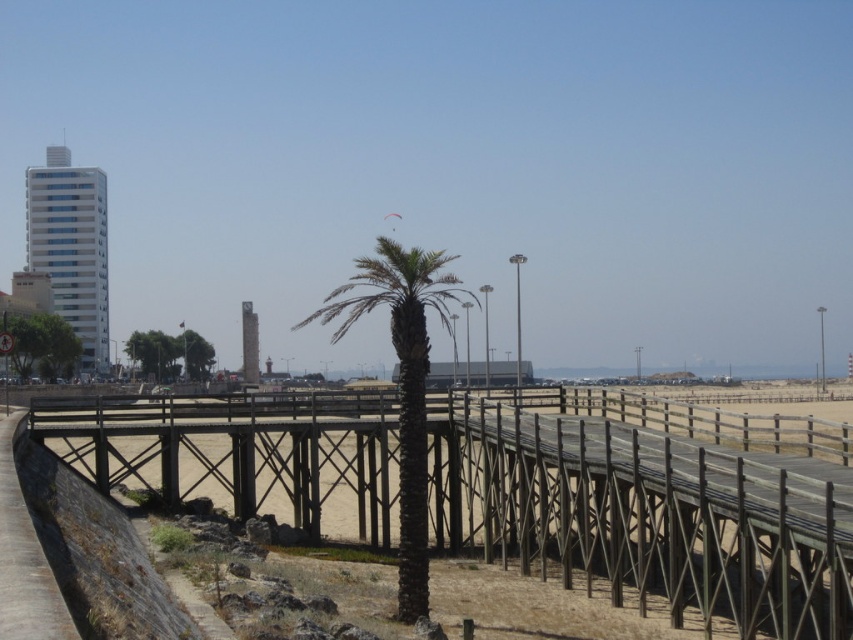
Does brown wooden bridge at center come in front of dark brown wood palm tree at center?

That is True.

Between point (637, 544) and point (395, 280), which one is positioned in front?

Point (395, 280) is in front.

Between point (86, 461) and point (424, 564), which one is positioned behind?

The point (86, 461) is more distant.

Find the location of `brown wooden bridge at center`. brown wooden bridge at center is located at coordinates (651, 502).

Is point (251, 477) behind point (0, 634)?

Yes, point (251, 477) is behind point (0, 634).

Can you confirm if brown wooden bridge at center is positioned to the left of brown wooden path at lower left?

Indeed, brown wooden bridge at center is positioned on the left side of brown wooden path at lower left.

You are a GUI agent. You are given a task and a screenshot of the screen. Output one action in this format:
    pyautogui.click(x=<x>, y=<y>)
    Task: Click on the brown wooden bridge at center
    
    Given the screenshot: What is the action you would take?
    pyautogui.click(x=651, y=502)

Who is lower down, dark brown wood palm tree at center or brown wooden path at lower left?

brown wooden path at lower left

Does dark brown wood palm tree at center appear on the left side of brown wooden path at lower left?

Yes, dark brown wood palm tree at center is to the left of brown wooden path at lower left.

At what (x,y) coordinates should I click in order to perform the action: click on dark brown wood palm tree at center. Please return your answer as a coordinate pair (x, y). Looking at the image, I should click on (402, 380).